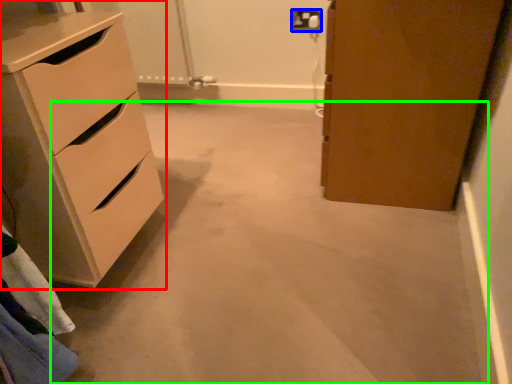
Question: Based on their relative distances, which object is nearer to chest of drawers (highlighted by a red box)? Choose from electric outlet (highlighted by a blue box) and concrete (highlighted by a green box).

Choices:
 (A) electric outlet
 (B) concrete

Answer: (B)